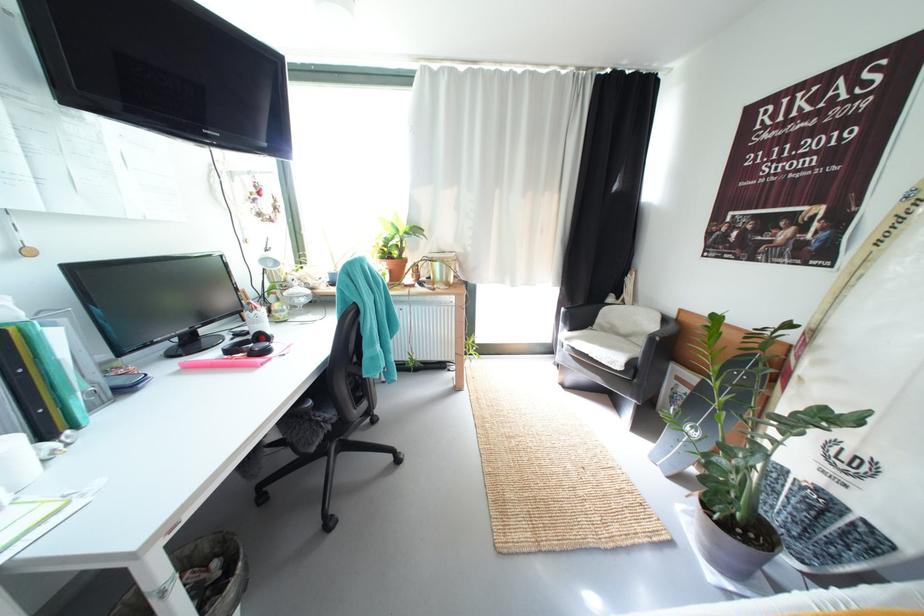
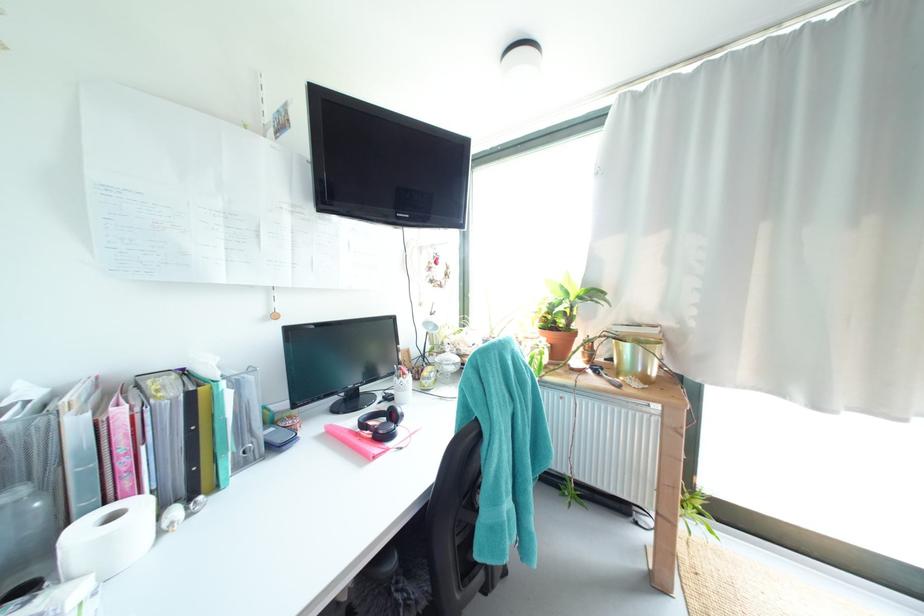
The point at (406,246) is marked in the first image. Where is the corresponding point in the second image?

(573, 315)